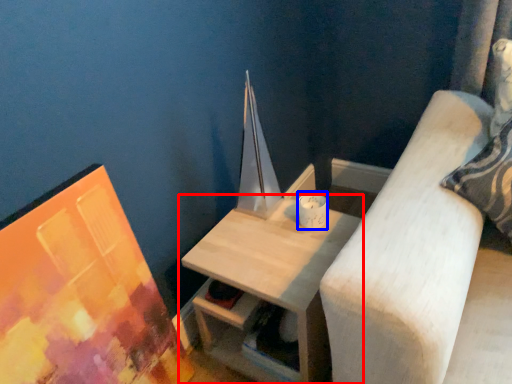
Question: Which object appears farthest to the camera in this image, table (highlighted by a red box) or candle holder (highlighted by a blue box)?

Choices:
 (A) table
 (B) candle holder

Answer: (B)